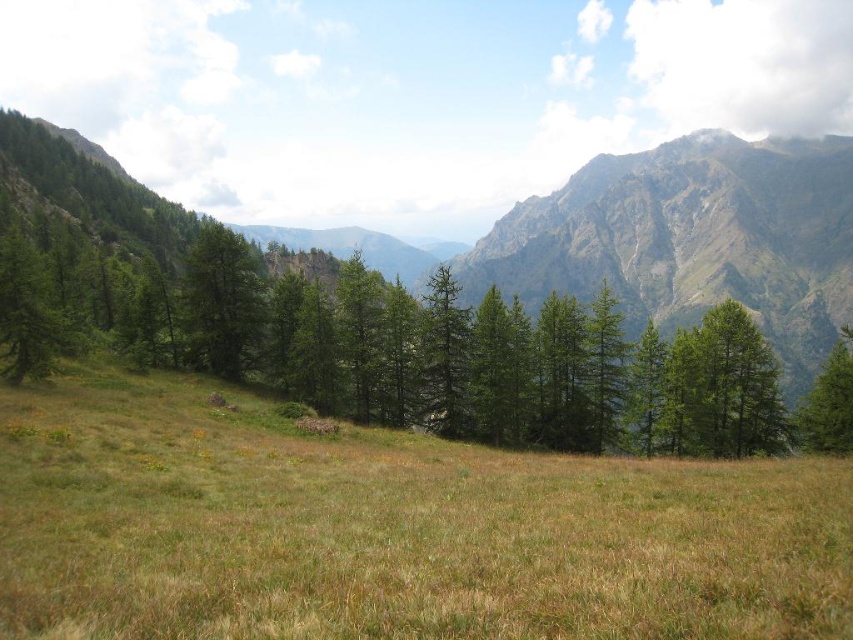
You are standing at the origin point of the coordinate system in the image. You want to locate the green matte tree at upper left. Which direction should you look to find it?

The green matte tree at upper left is located at point 0.472 on the x axis and 0.261 on the y axis. Since the coordinates are given in a normalized system where the origin is at the bottom left corner, the tree is to the right and above the origin. Therefore, you should look to the upper left direction from your current position to locate it.

You are standing in the mountainous landscape and want to determine which of the two points, point (251, 294) or point (802, 403), is nearer to your current position. Based on the scene description, which point is closer?

Point (251, 294) is closer to the camera than point (802, 403), so it is nearer to your current position.